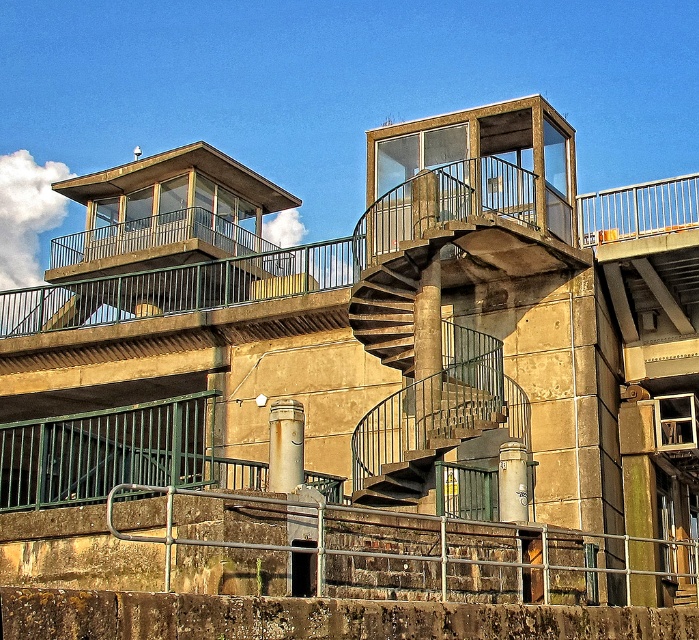
You are an engineer inspecting the structure. You need to determine which object is taller between the rusty metal pipe at center and the metallic gray cylinder at lower center based on the scene. Which one is taller?

The rusty metal pipe at center is taller than the metallic gray cylinder at lower center according to the description.